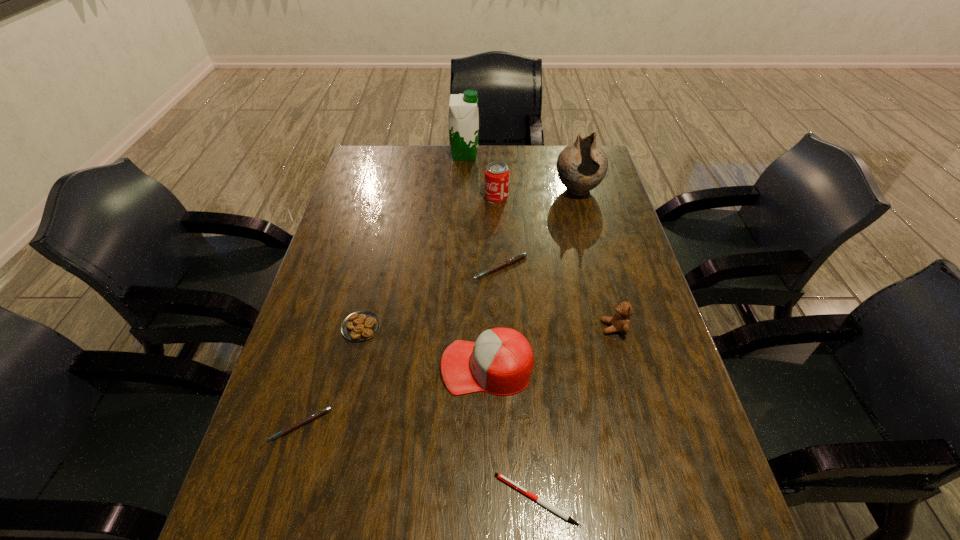
Find the location of a particular element. The width and height of the screenshot is (960, 540). pottery located in the far edge section of the desktop is located at coordinates (581, 166).

Image resolution: width=960 pixels, height=540 pixels. I want to click on pastry positioned at the left edge, so click(359, 326).

Identify the location of pen that is at the left edge. Image resolution: width=960 pixels, height=540 pixels. (312, 417).

This screenshot has width=960, height=540. Find the location of `pottery at the right edge`. pottery at the right edge is located at coordinates (581, 166).

Identify the location of teddy bear that is at the right edge. The image size is (960, 540). coord(620,322).

In order to click on object present at the far right corner in this screenshot , I will do `click(581, 166)`.

Locate an element on the screen. The image size is (960, 540). vacant region at the far edge of the desktop is located at coordinates (491, 153).

In order to click on vacant space at the left edge in this screenshot , I will do `click(343, 285)`.

You are a GUI agent. You are given a task and a screenshot of the screen. Output one action in this format:
    pyautogui.click(x=<x>, y=<y>)
    Task: Click on the vacant space at the right edge of the desktop
    The height and width of the screenshot is (540, 960).
    Given the screenshot: What is the action you would take?
    pyautogui.click(x=676, y=376)

Identify the location of free spot at the far left corner of the desktop. (x=368, y=146).